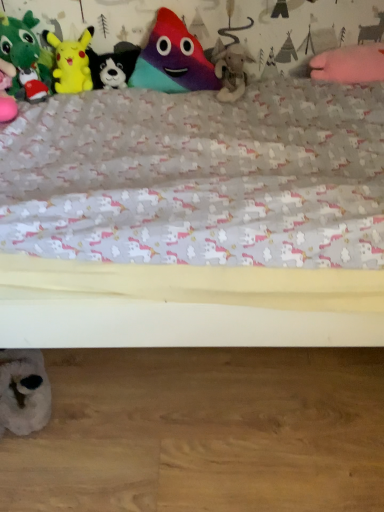
Identify the location of white plush toy at lower left, marked as the 6th toy in a top-to-bottom arrangement. This screenshot has height=512, width=384. (x=23, y=391).

The image size is (384, 512). Find the location of `fuzzy beige stuffed animal at center, which is the fifth toy from top to bottom`. fuzzy beige stuffed animal at center, which is the fifth toy from top to bottom is located at coordinates (230, 70).

Locate an element on the screen. green plush toy at left, arranged as the fourth toy when ordered from the bottom is located at coordinates (25, 57).

The height and width of the screenshot is (512, 384). I want to click on white plush toy at lower left, which appears as the 1th toy when ordered from the bottom, so click(23, 391).

Measure the distance from multicolored plush toy at center, the 1th toy from the top, to fuzzy beige stuffed animal at center, which is the fifth toy from top to bottom.

They are 5.64 inches apart.

Considering the sizes of objects multicolored plush toy at center, the 1th toy from the top, and fuzzy beige stuffed animal at center, which is the second toy in bottom-to-top order, in the image provided, who is thinner, multicolored plush toy at center, the 1th toy from the top, or fuzzy beige stuffed animal at center, which is the second toy in bottom-to-top order,?

multicolored plush toy at center, the 1th toy from the top.

Is multicolored plush toy at center, the 1th toy from the top, in front of or behind fuzzy beige stuffed animal at center, which is the second toy in bottom-to-top order, in the image?

multicolored plush toy at center, the 1th toy from the top, is behind fuzzy beige stuffed animal at center, which is the second toy in bottom-to-top order.

From a real-world perspective, is multicolored plush toy at center, the 1th toy from the top, located higher than yellow plush at upper left, the 5th toy positioned from the bottom?

Yes.

From the picture: Could you tell me if multicolored plush toy at center, the 1th toy from the top, is facing yellow plush at upper left, acting as the second toy starting from the top?

No, multicolored plush toy at center, the 1th toy from the top, is not oriented towards yellow plush at upper left, acting as the second toy starting from the top.

Considering the sizes of multicolored plush toy at center, the 1th toy from the top, and yellow plush at upper left, the 5th toy positioned from the bottom, in the image, is multicolored plush toy at center, the 1th toy from the top, wider or thinner than yellow plush at upper left, the 5th toy positioned from the bottom,?

Clearly, multicolored plush toy at center, the 1th toy from the top, has less width compared to yellow plush at upper left, the 5th toy positioned from the bottom.

Are multicolored plush toy at center, which is the 6th toy from bottom to top, and yellow plush at upper left, acting as the second toy starting from the top, located far from each other?

No, multicolored plush toy at center, which is the 6th toy from bottom to top, is not far from yellow plush at upper left, acting as the second toy starting from the top.

Can you confirm if multicolored plush toy at center, which is the 6th toy from bottom to top, is thinner than green plush toy at left, marked as the third toy in a top-to-bottom arrangement?

Yes, multicolored plush toy at center, which is the 6th toy from bottom to top, is thinner than green plush toy at left, marked as the third toy in a top-to-bottom arrangement.

From a real-world perspective, is multicolored plush toy at center, which is the 6th toy from bottom to top, on top of green plush toy at left, arranged as the fourth toy when ordered from the bottom?

No, from a real-world perspective, multicolored plush toy at center, which is the 6th toy from bottom to top, is not above green plush toy at left, arranged as the fourth toy when ordered from the bottom.

Is multicolored plush toy at center, which is the 6th toy from bottom to top, far from green plush toy at left, arranged as the fourth toy when ordered from the bottom?

No, multicolored plush toy at center, which is the 6th toy from bottom to top, is in close proximity to green plush toy at left, arranged as the fourth toy when ordered from the bottom.

Is multicolored plush toy at center, the 1th toy from the top, facing away from green plush toy at left, arranged as the fourth toy when ordered from the bottom?

No.

Which is less distant, (116,78) or (7,361)?

Point (116,78) is positioned farther from the camera compared to point (7,361).

Based on their sizes in the image, would you say black plush dog at upper center, the third toy from the bottom, is bigger or smaller than white plush toy at lower left, marked as the 6th toy in a top-to-bottom arrangement?

In the image, black plush dog at upper center, the third toy from the bottom, appears to be smaller than white plush toy at lower left, marked as the 6th toy in a top-to-bottom arrangement.

Is the surface of black plush dog at upper center, the third toy from the bottom, in direct contact with white plush toy at lower left, marked as the 6th toy in a top-to-bottom arrangement?

No, black plush dog at upper center, the third toy from the bottom, is not next to white plush toy at lower left, marked as the 6th toy in a top-to-bottom arrangement.

Based on their positions, is black plush dog at upper center, positioned as the fourth toy in top-to-bottom order, located to the left or right of white plush toy at lower left, which appears as the 1th toy when ordered from the bottom?

black plush dog at upper center, positioned as the fourth toy in top-to-bottom order, is to the right of white plush toy at lower left, which appears as the 1th toy when ordered from the bottom.

Does black plush dog at upper center, positioned as the fourth toy in top-to-bottom order, have a greater height compared to fuzzy beige stuffed animal at center, which is the second toy in bottom-to-top order?

In fact, black plush dog at upper center, positioned as the fourth toy in top-to-bottom order, may be shorter than fuzzy beige stuffed animal at center, which is the second toy in bottom-to-top order.

Does black plush dog at upper center, the third toy from the bottom, have a lesser width compared to fuzzy beige stuffed animal at center, which is the fifth toy from top to bottom?

Correct, the width of black plush dog at upper center, the third toy from the bottom, is less than that of fuzzy beige stuffed animal at center, which is the fifth toy from top to bottom.

Does black plush dog at upper center, positioned as the fourth toy in top-to-bottom order, have a smaller size compared to fuzzy beige stuffed animal at center, which is the second toy in bottom-to-top order?

Yes, black plush dog at upper center, positioned as the fourth toy in top-to-bottom order, is smaller than fuzzy beige stuffed animal at center, which is the second toy in bottom-to-top order.

Between white plush toy at lower left, marked as the 6th toy in a top-to-bottom arrangement, and multicolored plush toy at center, which is the 6th toy from bottom to top, which one is positioned in front?

Positioned in front is white plush toy at lower left, marked as the 6th toy in a top-to-bottom arrangement.

Is white plush toy at lower left, marked as the 6th toy in a top-to-bottom arrangement, not near multicolored plush toy at center, which is the 6th toy from bottom to top?

No.

From a real-world perspective, between white plush toy at lower left, marked as the 6th toy in a top-to-bottom arrangement, and multicolored plush toy at center, the 1th toy from the top, who is vertically lower?

From a 3D spatial view, white plush toy at lower left, marked as the 6th toy in a top-to-bottom arrangement, is below.

Does point (90, 52) come behind point (167, 59)?

That is True.

Is black plush dog at upper center, the third toy from the bottom, further to camera compared to multicolored plush toy at center, which is the 6th toy from bottom to top?

That is True.

From a real-world perspective, who is located higher, black plush dog at upper center, the third toy from the bottom, or multicolored plush toy at center, the 1th toy from the top?

multicolored plush toy at center, the 1th toy from the top, is physically above.

Are black plush dog at upper center, positioned as the fourth toy in top-to-bottom order, and multicolored plush toy at center, the 1th toy from the top, located far from each other?

No, black plush dog at upper center, positioned as the fourth toy in top-to-bottom order, is not far from multicolored plush toy at center, the 1th toy from the top.

From a real-world perspective, count 3rd toys downward from the multicolored plush toy at center, which is the 6th toy from bottom to top, and point to it. Please provide its 2D coordinates.

[(230, 70)]

The height and width of the screenshot is (512, 384). Find the location of `the 2nd toy counting from the left side of the multicolored plush toy at center, which is the 6th toy from bottom to top`. the 2nd toy counting from the left side of the multicolored plush toy at center, which is the 6th toy from bottom to top is located at coordinates (71, 63).

Based on their spatial positions, is fuzzy beige stuffed animal at center, which is the fifth toy from top to bottom, or multicolored plush toy at center, which is the 6th toy from bottom to top, further from yellow plush at upper left, the 5th toy positioned from the bottom?

The object further to yellow plush at upper left, the 5th toy positioned from the bottom, is fuzzy beige stuffed animal at center, which is the fifth toy from top to bottom.

Which object lies nearer to the anchor point black plush dog at upper center, positioned as the fourth toy in top-to-bottom order, fuzzy beige stuffed animal at center, which is the second toy in bottom-to-top order, or multicolored plush toy at center, the 1th toy from the top?

The object closer to black plush dog at upper center, positioned as the fourth toy in top-to-bottom order, is multicolored plush toy at center, the 1th toy from the top.

When comparing their distances from black plush dog at upper center, positioned as the fourth toy in top-to-bottom order, does multicolored plush toy at center, the 1th toy from the top, or green plush toy at left, marked as the third toy in a top-to-bottom arrangement, seem closer?

multicolored plush toy at center, the 1th toy from the top, is closer to black plush dog at upper center, positioned as the fourth toy in top-to-bottom order.

Estimate the real-world distances between objects in this image. Which object is closer to fuzzy beige stuffed animal at center, which is the fifth toy from top to bottom, multicolored plush toy at center, the 1th toy from the top, or white plush toy at lower left, which appears as the 1th toy when ordered from the bottom?

multicolored plush toy at center, the 1th toy from the top, lies closer to fuzzy beige stuffed animal at center, which is the fifth toy from top to bottom, than the other object.

Based on their spatial positions, is multicolored plush toy at center, which is the 6th toy from bottom to top, or yellow plush at upper left, acting as the second toy starting from the top, further from fuzzy beige stuffed animal at center, which is the second toy in bottom-to-top order?

yellow plush at upper left, acting as the second toy starting from the top.

Consider the image. Based on their spatial positions, is white plush toy at lower left, marked as the 6th toy in a top-to-bottom arrangement, or multicolored plush toy at center, which is the 6th toy from bottom to top, further from yellow plush at upper left, acting as the second toy starting from the top?

Among the two, white plush toy at lower left, marked as the 6th toy in a top-to-bottom arrangement, is located further to yellow plush at upper left, acting as the second toy starting from the top.

Estimate the real-world distances between objects in this image. Which object is further from green plush toy at left, arranged as the fourth toy when ordered from the bottom, yellow plush at upper left, the 5th toy positioned from the bottom, or white plush toy at lower left, marked as the 6th toy in a top-to-bottom arrangement?

white plush toy at lower left, marked as the 6th toy in a top-to-bottom arrangement, is positioned further to the anchor green plush toy at left, arranged as the fourth toy when ordered from the bottom.

Looking at the image, which one is located further to white plush toy at lower left, which appears as the 1th toy when ordered from the bottom, green plush toy at left, arranged as the fourth toy when ordered from the bottom, or multicolored plush toy at center, which is the 6th toy from bottom to top?

multicolored plush toy at center, which is the 6th toy from bottom to top, lies further to white plush toy at lower left, which appears as the 1th toy when ordered from the bottom, than the other object.

Where is `toy situated between yellow plush at upper left, acting as the second toy starting from the top, and multicolored plush toy at center, the 1th toy from the top, from left to right`? This screenshot has height=512, width=384. toy situated between yellow plush at upper left, acting as the second toy starting from the top, and multicolored plush toy at center, the 1th toy from the top, from left to right is located at coordinates click(x=113, y=66).

You are a GUI agent. You are given a task and a screenshot of the screen. Output one action in this format:
    pyautogui.click(x=<x>, y=<y>)
    Task: Click on the toy between black plush dog at upper center, positioned as the fourth toy in top-to-bottom order, and fuzzy beige stuffed animal at center, which is the second toy in bottom-to-top order
    This screenshot has width=384, height=512.
    Given the screenshot: What is the action you would take?
    pyautogui.click(x=173, y=59)

The height and width of the screenshot is (512, 384). What are the coordinates of `toy that lies between black plush dog at upper center, the third toy from the bottom, and white plush toy at lower left, marked as the 6th toy in a top-to-bottom arrangement, from top to bottom` in the screenshot? It's located at (230, 70).